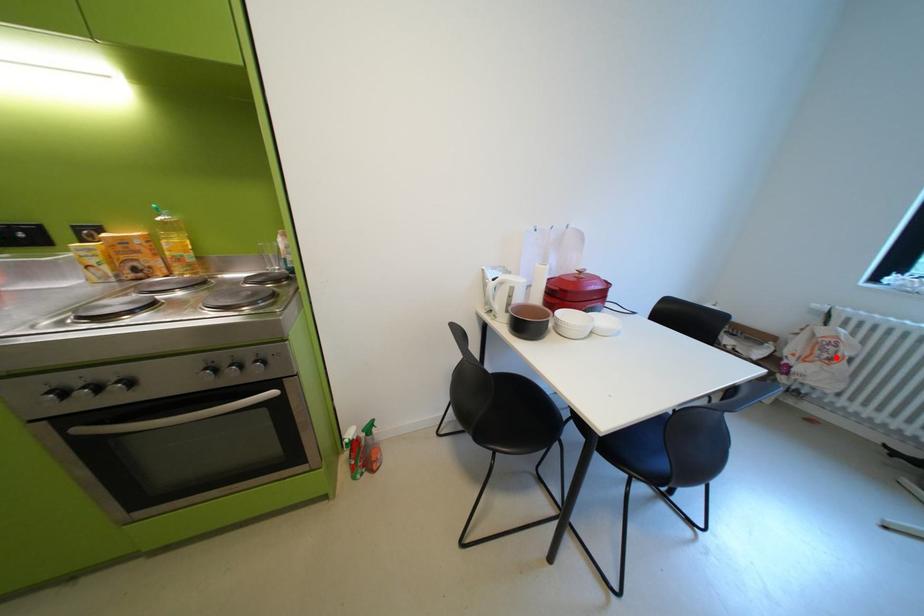
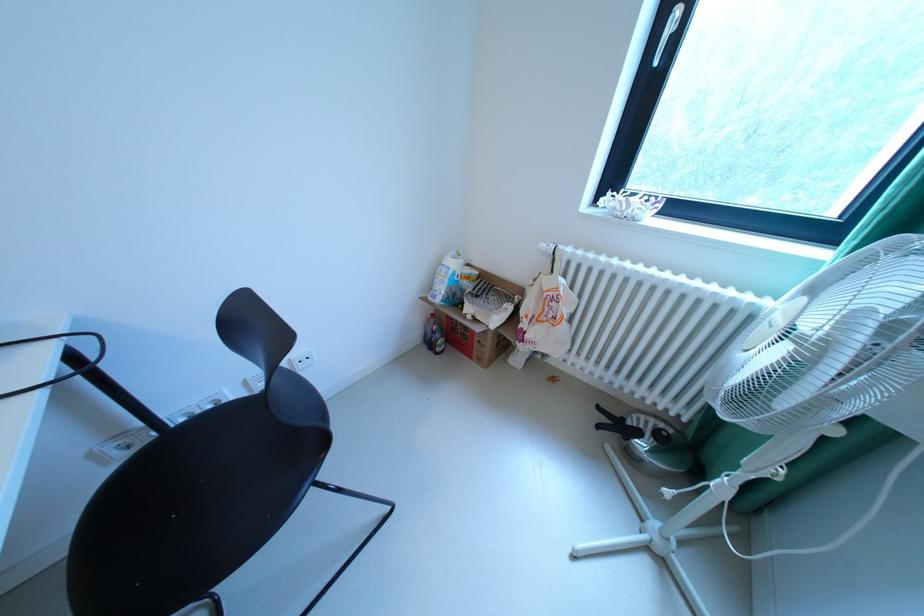
Find the pixel in the second image that matches the highlighted location in the first image.

(561, 317)